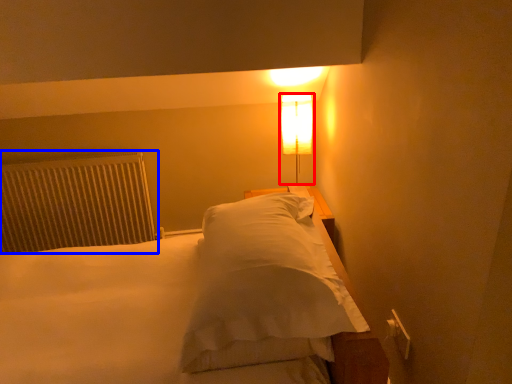
Question: Which of the following is the closest to the observer, lamp (highlighted by a red box) or radiator (highlighted by a blue box)?

Choices:
 (A) lamp
 (B) radiator

Answer: (A)